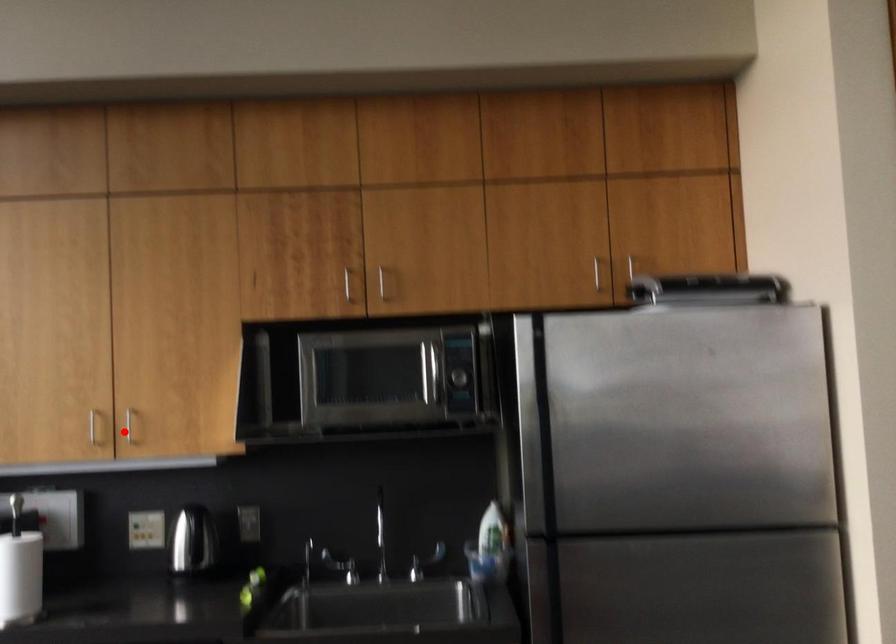
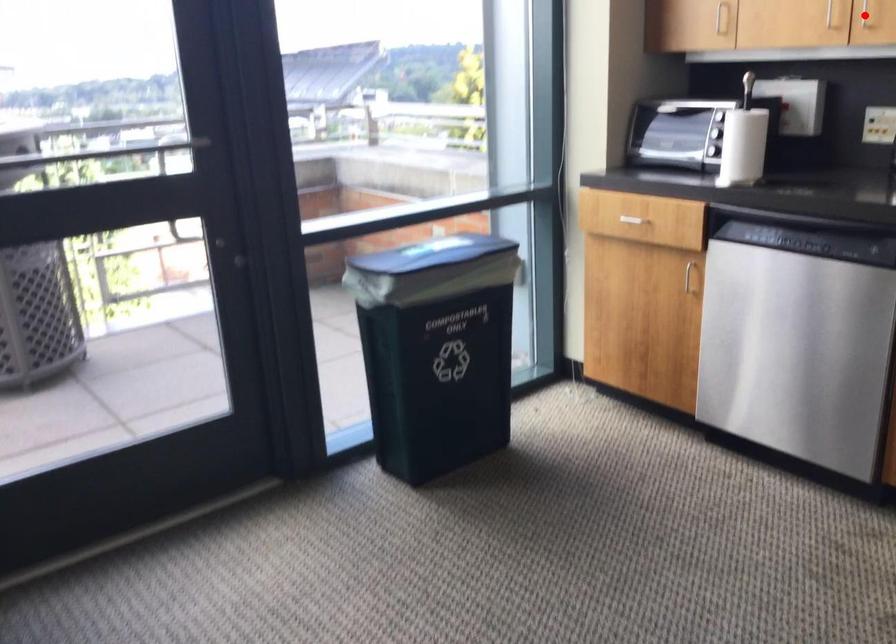
I am providing you with two images of the same scene from different viewpoints. A red point is marked on the first image and another point is marked on the second image. Do the highlighted points in image1 and image2 indicate the same real-world spot?

Yes